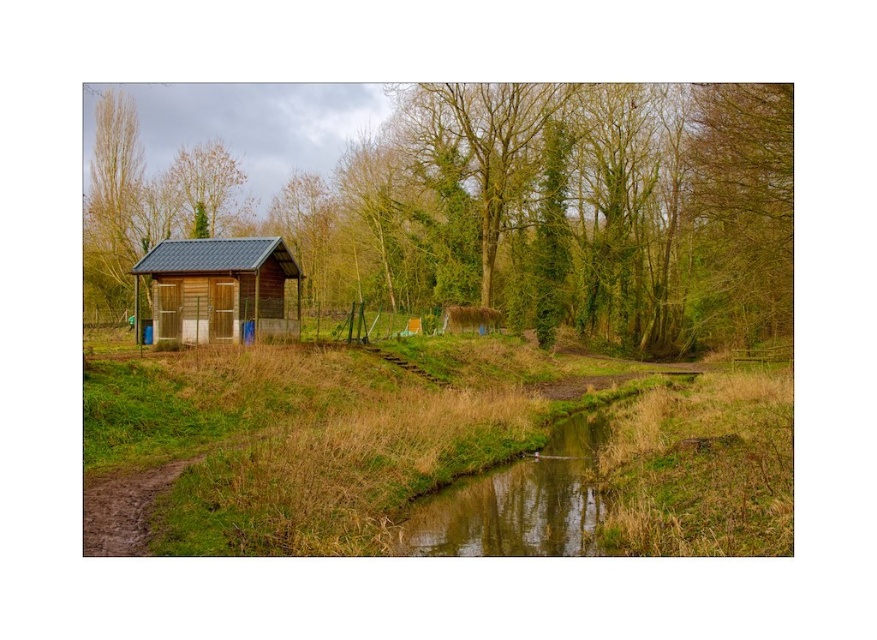
Which is more to the right, green leafy tree at upper left or brown textured tree at upper left?

brown textured tree at upper left

In the scene shown: Is green leafy tree at upper left closer to the viewer compared to brown textured tree at upper left?

Yes, it is in front of brown textured tree at upper left.

Which is behind, point (120, 292) or point (236, 216)?

Positioned behind is point (236, 216).

Where is `green leafy tree at upper left`? The width and height of the screenshot is (877, 640). green leafy tree at upper left is located at coordinates (113, 196).

Who is positioned more to the right, green grass at center or wooden cabin at left?

From the viewer's perspective, green grass at center appears more on the right side.

Is green grass at center smaller than wooden cabin at left?

No.

Who is more forward, [234,454] or [159,292]?

Point [234,454]

You are a GUI agent. You are given a task and a screenshot of the screen. Output one action in this format:
    pyautogui.click(x=<x>, y=<y>)
    Task: Click on the green grass at center
    
    Given the screenshot: What is the action you would take?
    pyautogui.click(x=429, y=452)

Is wooden cabin at left closer to the viewer compared to brown textured tree at upper left?

Yes, wooden cabin at left is in front of brown textured tree at upper left.

Who is more forward, (234, 260) or (207, 154)?

Positioned in front is point (234, 260).

Identify the location of wooden cabin at left. Image resolution: width=877 pixels, height=640 pixels. (218, 285).